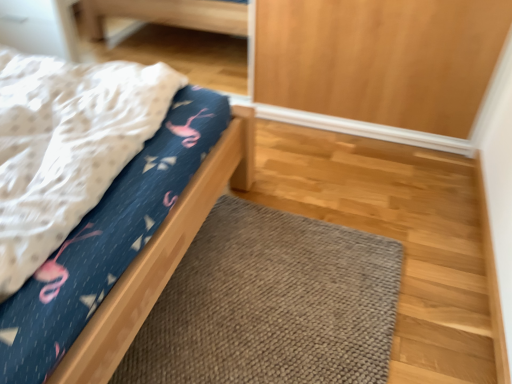
Where is `vacant space underneath brown knitted doormat at lower center (from a real-world perspective)`? vacant space underneath brown knitted doormat at lower center (from a real-world perspective) is located at coordinates (270, 318).